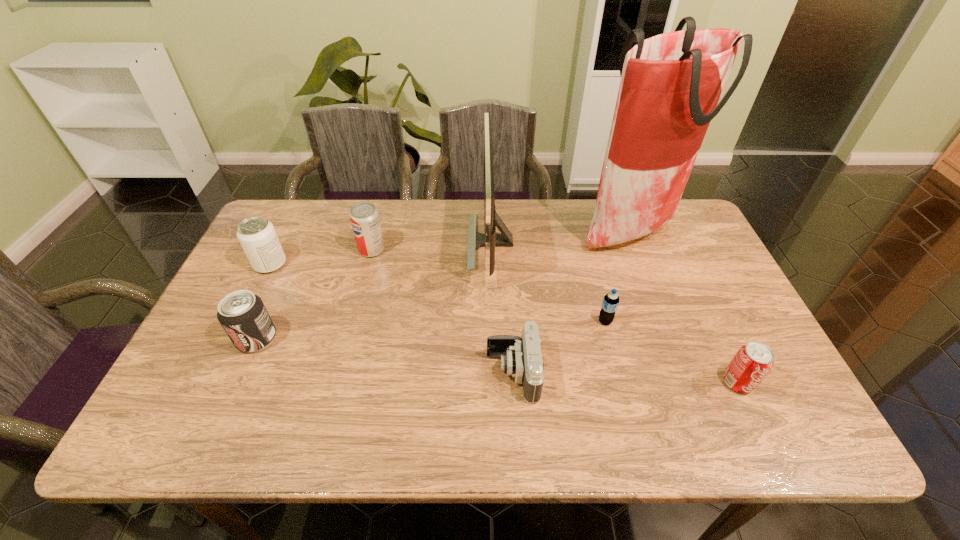
Identify the location of blank area in the image that satisfies the following two spatial constraints: 1. on the screen side of the seventh shortest object; 2. on the right side of the second soda bottle from right to left. (492, 321).